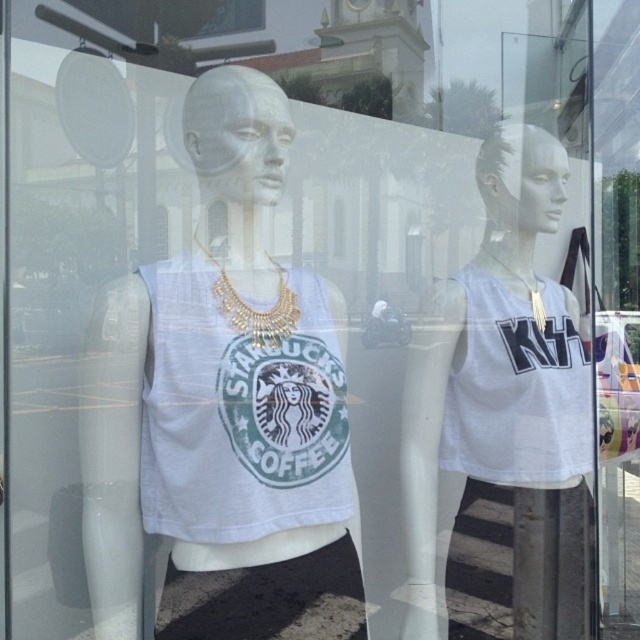
Is white fabric tank top at center thinner than white jersey at right?

In fact, white fabric tank top at center might be wider than white jersey at right.

Which of these two, white fabric tank top at center or white jersey at right, stands shorter?

white fabric tank top at center is shorter.

At what (x,y) coordinates should I click in order to perform the action: click on white fabric tank top at center. Please return your answer as a coordinate pair (x, y). The width and height of the screenshot is (640, 640). Looking at the image, I should click on (240, 413).

Can you confirm if white jersey at right is wider than gold metallic necklace at center?

Yes, white jersey at right is wider than gold metallic necklace at center.

Is white jersey at right shorter than gold metallic necklace at center?

No.

Which is behind, point (468, 310) or point (253, 332)?

The point (468, 310) is more distant.

Locate an element on the screen. The image size is (640, 640). white jersey at right is located at coordinates (516, 388).

Who is more distant from viewer, (129, 605) or (541, 317)?

Positioned behind is point (541, 317).

Which is more to the left, white matte tank top at center or gold metallic necklace at upper right?

white matte tank top at center is more to the left.

Who is more forward, [218,93] or [541,307]?

Point [218,93] is more forward.

The height and width of the screenshot is (640, 640). Identify the location of white matte tank top at center. (x=216, y=380).